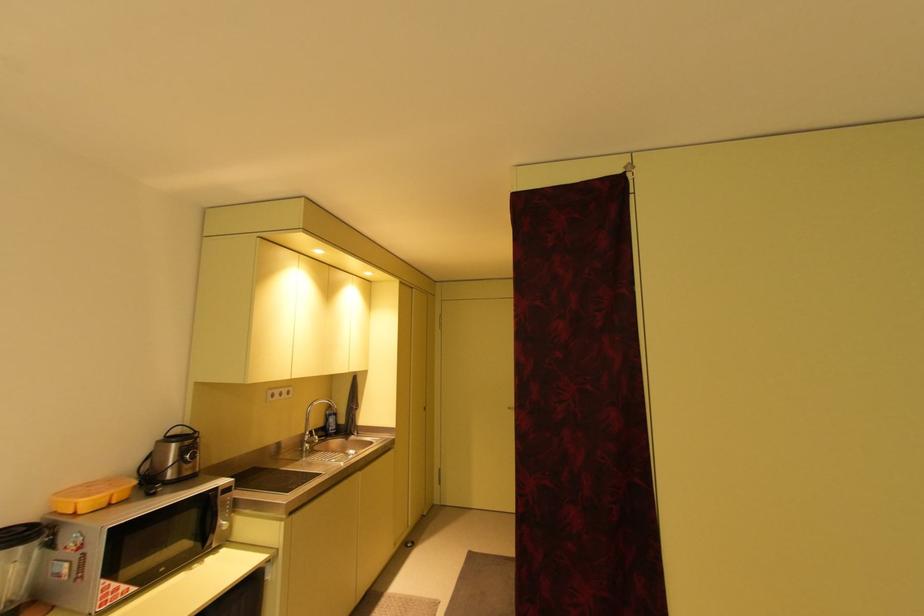
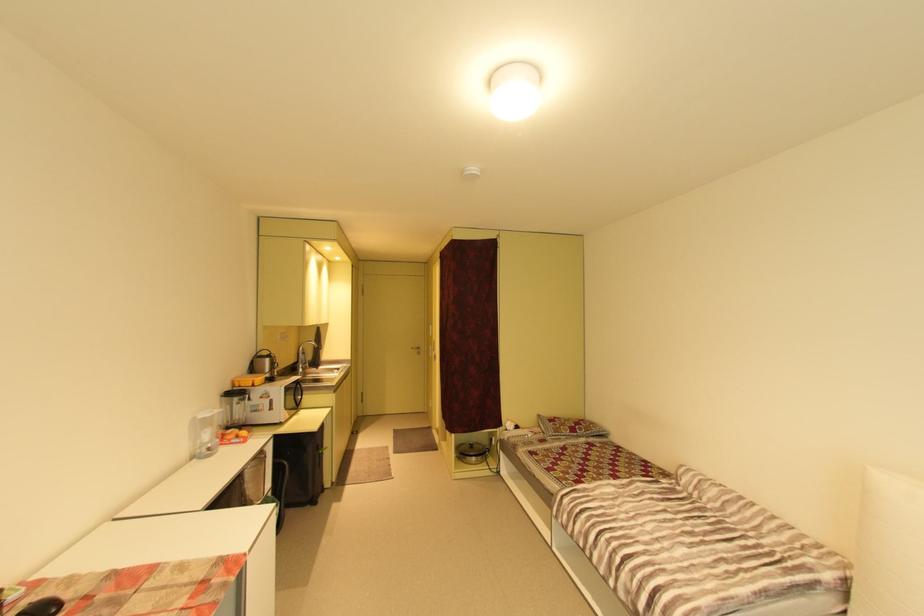
The point at (515, 408) is marked in the first image. Where is the corresponding point in the second image?

(419, 349)